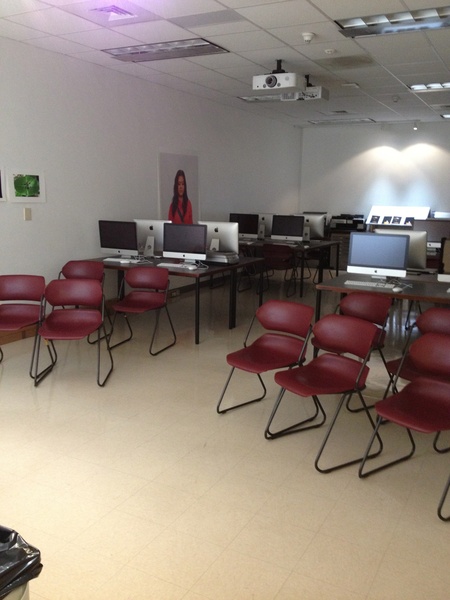
At what (x,y) coordinates should I click in order to perform the action: click on desk. Please return your answer as a coordinate pair (x, y). The height and width of the screenshot is (600, 450). Looking at the image, I should click on (207, 264).